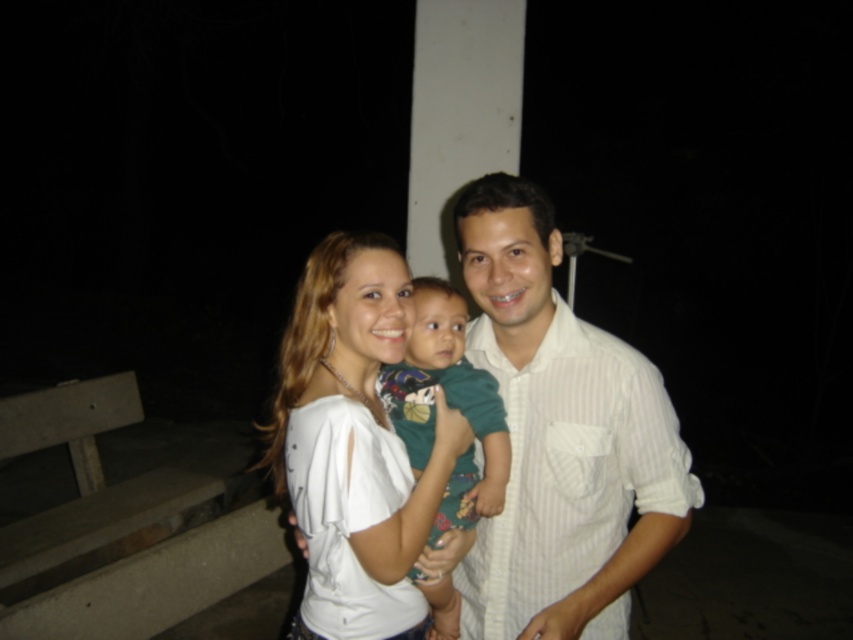
You are a photographer who wants to capture a photo of the two adults in the scene. The photographer needs to know the correct order of the adults from left to right based on their clothing. Which adult is wearing the white striped shirt at center and which is wearing the green fabric shirt at center?

The white striped shirt at center is to the right of the green fabric shirt at center, so the adult wearing the green fabric shirt at center is on the left, and the one in the white striped shirt at center is on the right.

You are a photographer trying to capture a group photo of two adults and a baby. You have a camera with a 10 cm wide lens. The two adults are wearing the white cotton shirt at center and the green fabric shirt at center. Can you fit both adults into the frame without moving them?

The distance between the white cotton shirt at center and the green fabric shirt at center is 12.99 centimeters. Since the lens is only 10 cm wide, the two adults cannot both fit into the frame without moving closer together.

You are a photographer standing in front of the white striped shirt at center. You want to take a photo of the scene without moving. Can you comfortably reach to adjust the focus on the camera if it is placed on a tripod 1 meter away from you?

The distance between you and the white striped shirt at center is 1.32 meters. Since the tripod is placed 1 meter away from you, you are within reach to adjust the camera focus without moving.